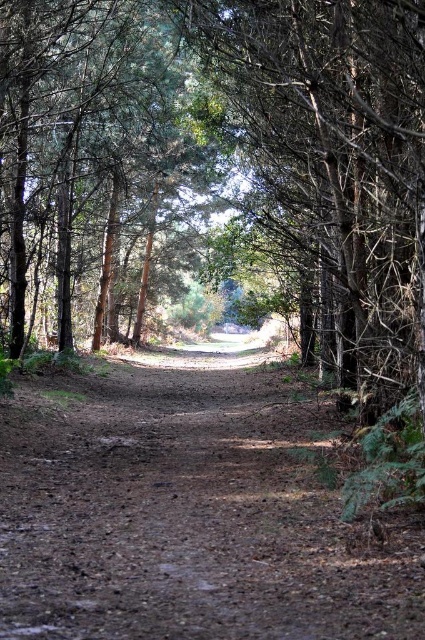
Does brown dirt track at center have a lesser height compared to green matte tree at center?

Yes, brown dirt track at center is shorter than green matte tree at center.

Does brown dirt track at center appear over green matte tree at center?

No, brown dirt track at center is not above green matte tree at center.

Image resolution: width=425 pixels, height=640 pixels. I want to click on brown dirt track at center, so click(x=186, y=512).

I want to click on brown dirt track at center, so pyautogui.click(x=186, y=512).